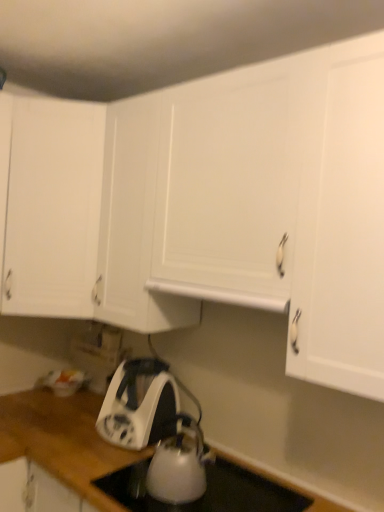
Question: From a real-world perspective, is white glossy electric kettle at lower center beneath white glossy kettle at lower center?

Choices:
 (A) yes
 (B) no

Answer: (B)

Question: Can you confirm if white glossy electric kettle at lower center is shorter than white glossy kettle at lower center?

Choices:
 (A) yes
 (B) no

Answer: (B)

Question: Are white glossy electric kettle at lower center and white glossy kettle at lower center located far from each other?

Choices:
 (A) no
 (B) yes

Answer: (A)

Question: Is white glossy electric kettle at lower center taller than white glossy kettle at lower center?

Choices:
 (A) no
 (B) yes

Answer: (B)

Question: Is white glossy electric kettle at lower center at the right side of white glossy kettle at lower center?

Choices:
 (A) yes
 (B) no

Answer: (B)

Question: In terms of width, does white glossy electric kettle at lower center look wider or thinner when compared to white matte cabinet at upper left?

Choices:
 (A) thin
 (B) wide

Answer: (A)

Question: From the image's perspective, is white glossy electric kettle at lower center positioned above or below white matte cabinet at upper left?

Choices:
 (A) above
 (B) below

Answer: (B)

Question: Would you say white glossy electric kettle at lower center is to the left or to the right of white matte cabinet at upper left in the picture?

Choices:
 (A) right
 (B) left

Answer: (A)

Question: From a real-world perspective, is white glossy electric kettle at lower center physically located above or below white matte cabinet at upper left?

Choices:
 (A) below
 (B) above

Answer: (A)

Question: Looking at their shapes, would you say white glossy kettle at lower center is wider or thinner than white matte exhaust hood at center?

Choices:
 (A) thin
 (B) wide

Answer: (A)

Question: Is white glossy kettle at lower center bigger or smaller than white matte exhaust hood at center?

Choices:
 (A) small
 (B) big

Answer: (B)

Question: In terms of height, does white glossy kettle at lower center look taller or shorter compared to white matte exhaust hood at center?

Choices:
 (A) tall
 (B) short

Answer: (A)

Question: From the image's perspective, is white glossy kettle at lower center above or below white matte exhaust hood at center?

Choices:
 (A) above
 (B) below

Answer: (B)

Question: Considering their positions, is white matte cabinet at upper left located in front of or behind white glossy kettle at lower center?

Choices:
 (A) behind
 (B) front

Answer: (A)

Question: Is white matte cabinet at upper left taller or shorter than white glossy kettle at lower center?

Choices:
 (A) tall
 (B) short

Answer: (A)